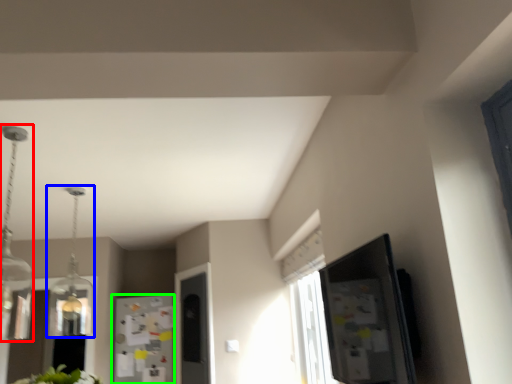
Question: Based on their relative distances, which object is farther from light fixture (highlighted by a red box)? Choose from light fixture (highlighted by a blue box) and fridge (highlighted by a green box).

Choices:
 (A) light fixture
 (B) fridge

Answer: (B)